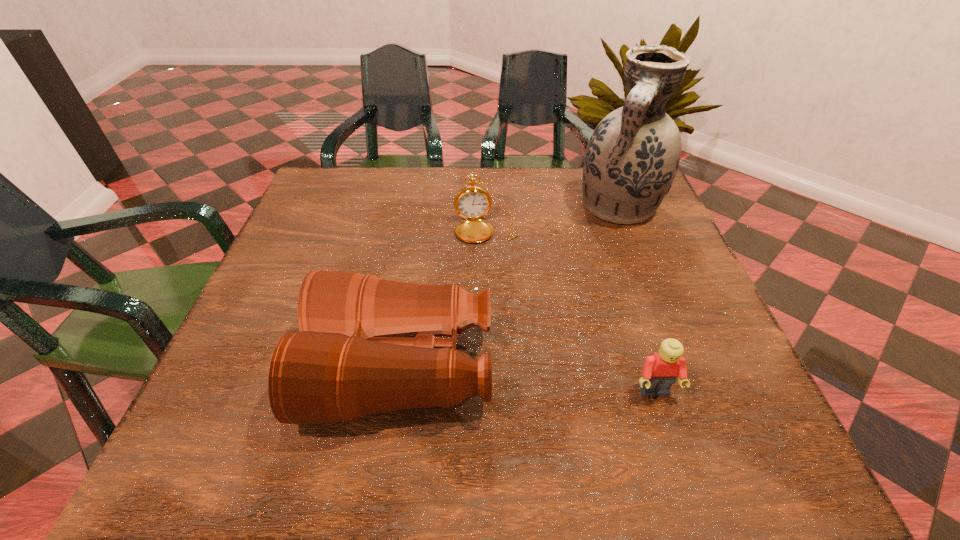
In order to click on free space between the pocket watch and the tallest object in this screenshot , I will do (553, 218).

At what (x,y) coordinates should I click in order to perform the action: click on empty location between the pocket watch and the vase. Please return your answer as a coordinate pair (x, y). The width and height of the screenshot is (960, 540). Looking at the image, I should click on (553, 218).

Locate an element on the screen. The height and width of the screenshot is (540, 960). vacant point located between the Lego and the pocket watch is located at coordinates (570, 310).

Locate an element on the screen. free point between the Lego and the pocket watch is located at coordinates (570, 310).

This screenshot has width=960, height=540. Identify the location of object that can be found as the closest to the vase. (472, 202).

Identify which object is the third closest to the binoculars. Please provide its 2D coordinates. Your answer should be formatted as a tuple, i.e. [(x, y)], where the tuple contains the x and y coordinates of a point satisfying the conditions above.

[(632, 157)]

You are a GUI agent. You are given a task and a screenshot of the screen. Output one action in this format:
    pyautogui.click(x=<x>, y=<y>)
    Task: Click on the blank area in the image that satisfies the following two spatial constraints: 1. on the back side of the tallest object; 2. on the right side of the pocket watch
    This screenshot has height=540, width=960.
    Given the screenshot: What is the action you would take?
    pyautogui.click(x=486, y=207)